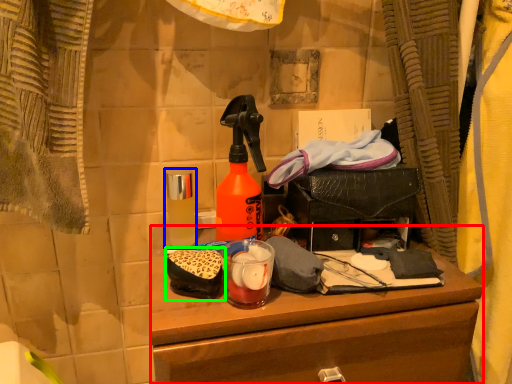
Question: Which is nearer to the desk (highlighted by a red box)? bottle (highlighted by a blue box) or debris (highlighted by a green box).

Choices:
 (A) bottle
 (B) debris

Answer: (B)